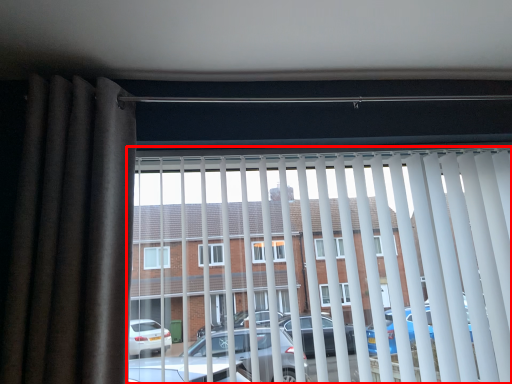
Question: Where is window blind (annotated by the red box) located in relation to curtain in the image?

Choices:
 (A) right
 (B) left

Answer: (A)